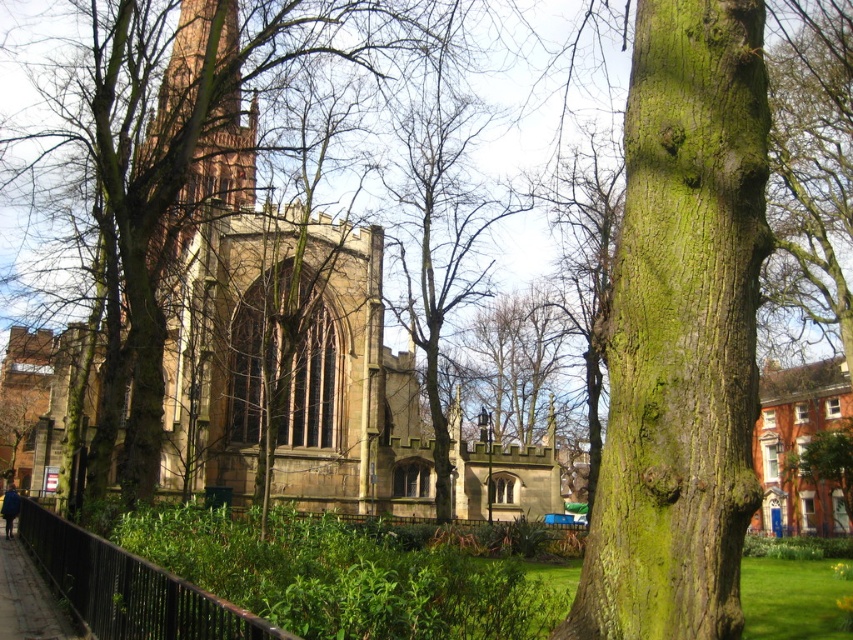
You are standing in the park and want to take a photo of the green mossy bark tree at center. If your camera has a maximum focus range of 40 meters, will you be able to focus on the tree?

The green mossy bark tree at center is 44.13 meters away from the camera. Since the camera can only focus up to 40 meters, it won not be able to focus on the tree.

You are a photographer standing in the park and want to take a photo of both the green mossy bark tree at center and the black metal fence at lower left. Which object should you focus on first to ensure both are in clear view?

The green mossy bark tree at center is further to the viewer than the black metal fence at lower left, so you should focus on the black metal fence at lower left first to ensure both are in clear view.